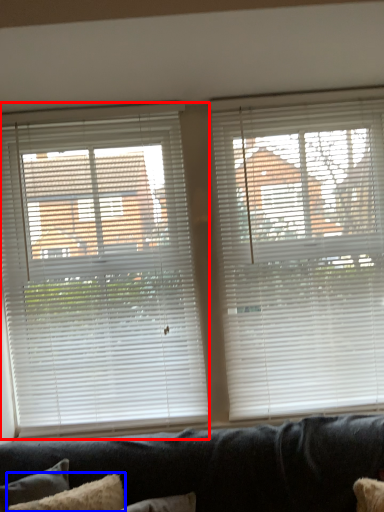
Question: Which object is closer to the camera taking this photo, window blind (highlighted by a red box) or pillow (highlighted by a blue box)?

Choices:
 (A) window blind
 (B) pillow

Answer: (B)